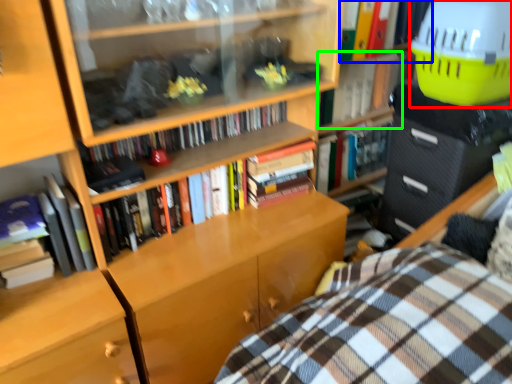
Question: Considering the real-world distances, which object is closest to basket (highlighted by a red box)? book (highlighted by a blue box) or book (highlighted by a green box).

Choices:
 (A) book
 (B) book

Answer: (A)